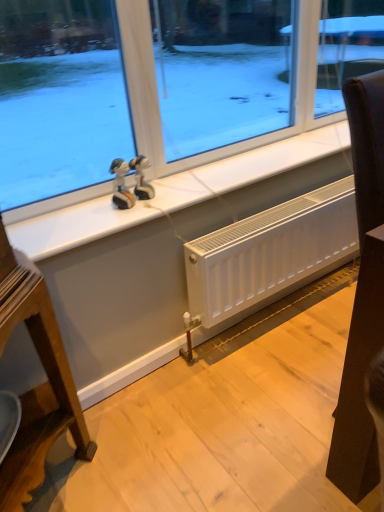
Identify the location of vacant space that is to the left of matte plastic figurine at center, the second figurine from the right. (83, 215).